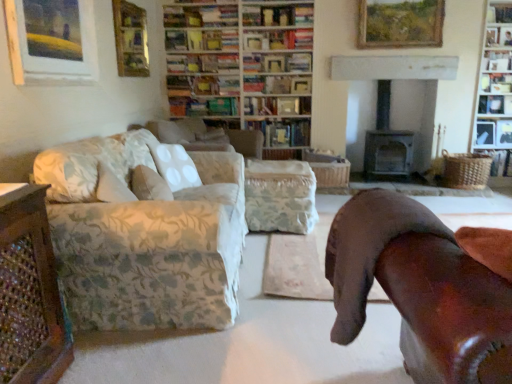
Question: From the image's perspective, is brown leather chair at right below wooden picture frame at upper left, the fourth picture frame from the back?

Choices:
 (A) no
 (B) yes

Answer: (B)

Question: Is brown leather chair at right taller than wooden picture frame at upper left, the fourth picture frame from the back?

Choices:
 (A) no
 (B) yes

Answer: (B)

Question: Can you confirm if brown leather chair at right is smaller than wooden picture frame at upper left, the 4th picture frame from the right?

Choices:
 (A) yes
 (B) no

Answer: (B)

Question: Is brown leather chair at right far away from wooden picture frame at upper left, the first picture frame when ordered from front to back?

Choices:
 (A) yes
 (B) no

Answer: (A)

Question: Is brown leather chair at right looking in the opposite direction of wooden picture frame at upper left, the 4th picture frame from the right?

Choices:
 (A) yes
 (B) no

Answer: (B)

Question: From a real-world perspective, relative to wooden bookshelf at upper center, arranged as the second bookcase when viewed from the right, is brown leather chair at right vertically above or below?

Choices:
 (A) above
 (B) below

Answer: (B)

Question: Based on their positions, is brown leather chair at right located to the left or right of wooden bookshelf at upper center, which appears as the first bookcase when viewed from the left?

Choices:
 (A) right
 (B) left

Answer: (A)

Question: From their relative heights in the image, would you say brown leather chair at right is taller or shorter than wooden bookshelf at upper center, which appears as the first bookcase when viewed from the left?

Choices:
 (A) tall
 (B) short

Answer: (B)

Question: In the image, is brown leather chair at right positioned in front of or behind wooden bookshelf at upper center, arranged as the second bookcase when viewed from the right?

Choices:
 (A) behind
 (B) front

Answer: (B)

Question: Is wooden picture frame at upper left, positioned as the second picture frame in front-to-back order, inside the boundaries of wooden picture frame at upper center, the third picture frame positioned from the front, or outside?

Choices:
 (A) inside
 (B) outside

Answer: (B)

Question: Based on their positions, is wooden picture frame at upper left, the third picture frame positioned from the back, located to the left or right of wooden picture frame at upper center, marked as the 2th picture frame in a back-to-front arrangement?

Choices:
 (A) right
 (B) left

Answer: (B)

Question: Looking at the image, does wooden picture frame at upper left, the 3th picture frame viewed from the right, seem bigger or smaller compared to wooden picture frame at upper center, which is counted as the third picture frame, starting from the left?

Choices:
 (A) big
 (B) small

Answer: (B)

Question: From a real-world perspective, is wooden picture frame at upper left, arranged as the second picture frame when viewed from the left, physically located above or below wooden picture frame at upper center, the third picture frame positioned from the front?

Choices:
 (A) above
 (B) below

Answer: (B)

Question: From the image's perspective, relative to wooden picture frame at upper left, the third picture frame positioned from the back, is woven brown basket at right, the first book from the right, above or below?

Choices:
 (A) above
 (B) below

Answer: (B)

Question: Looking at their shapes, would you say woven brown basket at right, the first book from the right, is wider or thinner than wooden picture frame at upper left, positioned as the second picture frame in front-to-back order?

Choices:
 (A) thin
 (B) wide

Answer: (B)